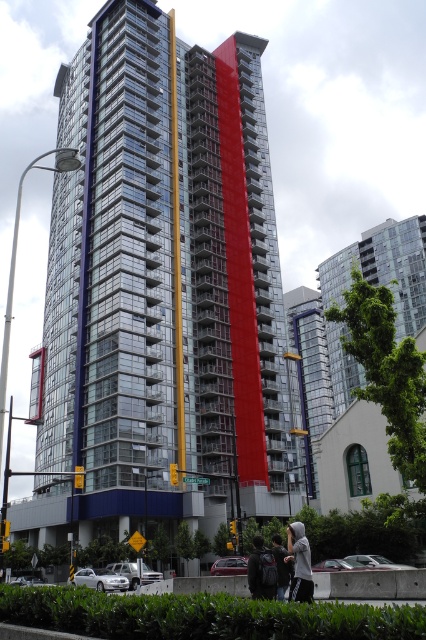
Does gray hoodie at center appear under gray hoodie at lower center?

Incorrect, gray hoodie at center is not positioned below gray hoodie at lower center.

Between point (302, 564) and point (279, 568), which one is positioned in front?

Point (302, 564) is more forward.

What do you see at coordinates (299, 563) in the screenshot? I see `gray hoodie at center` at bounding box center [299, 563].

The height and width of the screenshot is (640, 426). Find the location of `gray hoodie at center`. gray hoodie at center is located at coordinates (299, 563).

Can you confirm if dark gray backpack at center is bigger than gray hoodie at lower center?

No, dark gray backpack at center is not bigger than gray hoodie at lower center.

Who is more forward, (267, 563) or (282, 577)?

Positioned in front is point (267, 563).

The height and width of the screenshot is (640, 426). I want to click on dark gray backpack at center, so click(x=261, y=570).

Does gray hoodie at center come in front of dark gray backpack at center?

That is False.

Which is more to the right, gray hoodie at center or dark gray backpack at center?

Positioned to the right is gray hoodie at center.

Where is `gray hoodie at center`? gray hoodie at center is located at coordinates (299, 563).